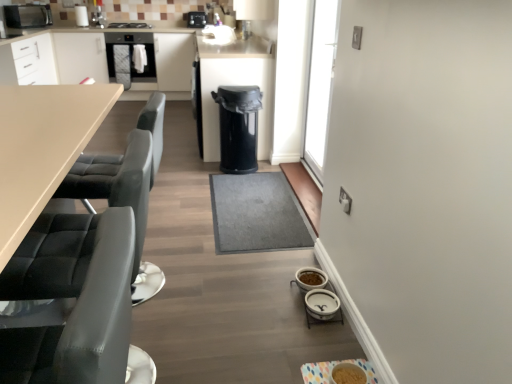
Locate an element on the screen. The height and width of the screenshot is (384, 512). free space to the left of white ceramic bowls at lower right, positioned as the 6th appliance in back-to-front order is located at coordinates (272, 303).